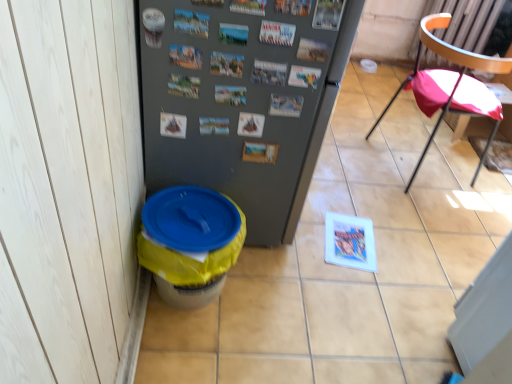
Where is `free location to the right of gray matte refrigerator at center`? This screenshot has height=384, width=512. free location to the right of gray matte refrigerator at center is located at coordinates (352, 230).